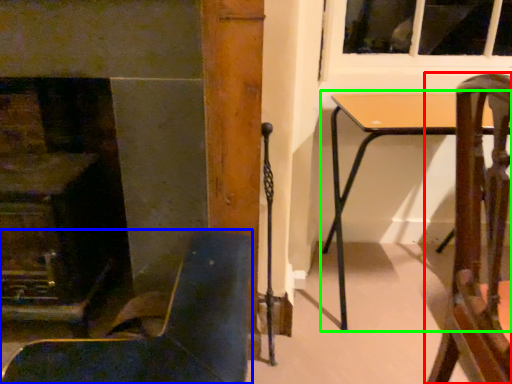
Question: Which object is the closest to the chair (highlighted by a red box)? Choose among these: chair (highlighted by a blue box) or table (highlighted by a green box).

Choices:
 (A) chair
 (B) table

Answer: (A)